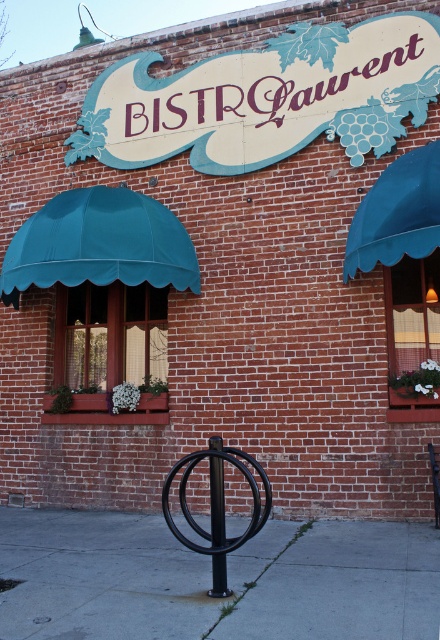
You are a delivery person with a cart that is 4 feet wide. You need to move from the gray concrete sidewalk at lower center to the black metal pole at center. Is there enough space for your cart to pass between them?

The gray concrete sidewalk at lower center is 3.85 feet away from the black metal pole at center. Since the distance between them is less than the cart width of 4 feet, the cart cannot pass through the space between them.

You are standing on the gray concrete sidewalk at lower center and want to reach the black metal pole at center. Which direction should you move to get there?

The gray concrete sidewalk at lower center is to the right of the black metal pole at center, so you should move to the left to reach the pole.

You are a painter who needs to decide which object to paint first. The teal fabric awning at upper right and the black metal pole at center are both in your view. Which object is wider?

The teal fabric awning at upper right is wider than the black metal pole at center according to the description.